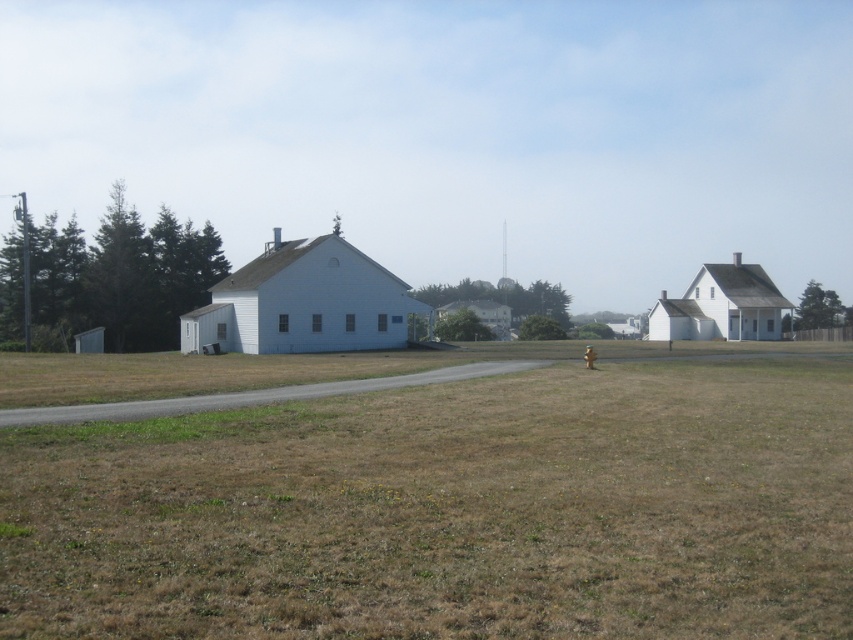
Which is more to the left, brown grassy field at center or brown matte hydrant at center?

brown grassy field at center is more to the left.

Does point (570, 490) come closer to viewer compared to point (590, 365)?

Yes, it is.

Locate an element on the screen. The width and height of the screenshot is (853, 640). brown grassy field at center is located at coordinates (437, 497).